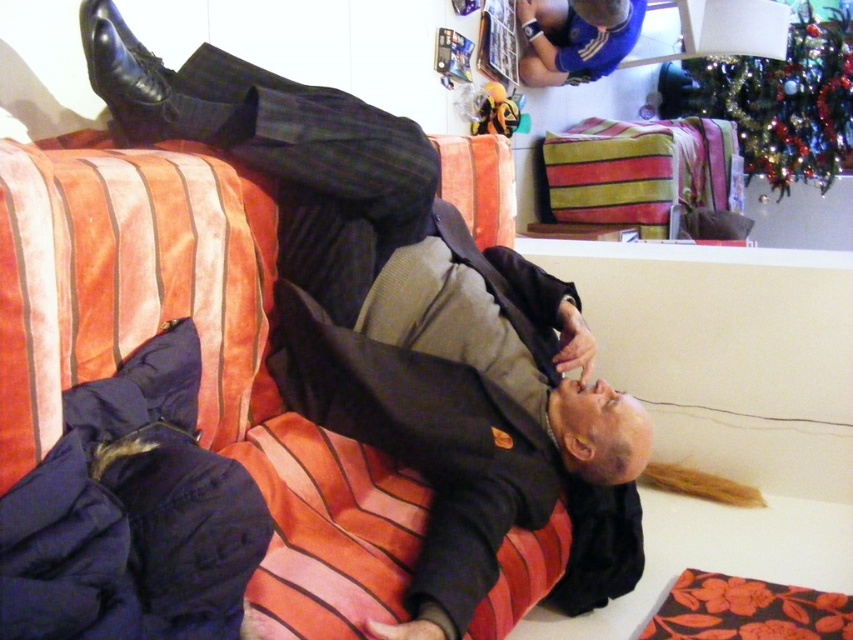
The image size is (853, 640). What do you see at coordinates (201, 356) in the screenshot?
I see `velvet striped couch at center` at bounding box center [201, 356].

Based on the photo, can you confirm if velvet striped couch at center is thinner than blue jersey at upper center?

In fact, velvet striped couch at center might be wider than blue jersey at upper center.

Locate an element on the screen. This screenshot has width=853, height=640. velvet striped couch at center is located at coordinates (201, 356).